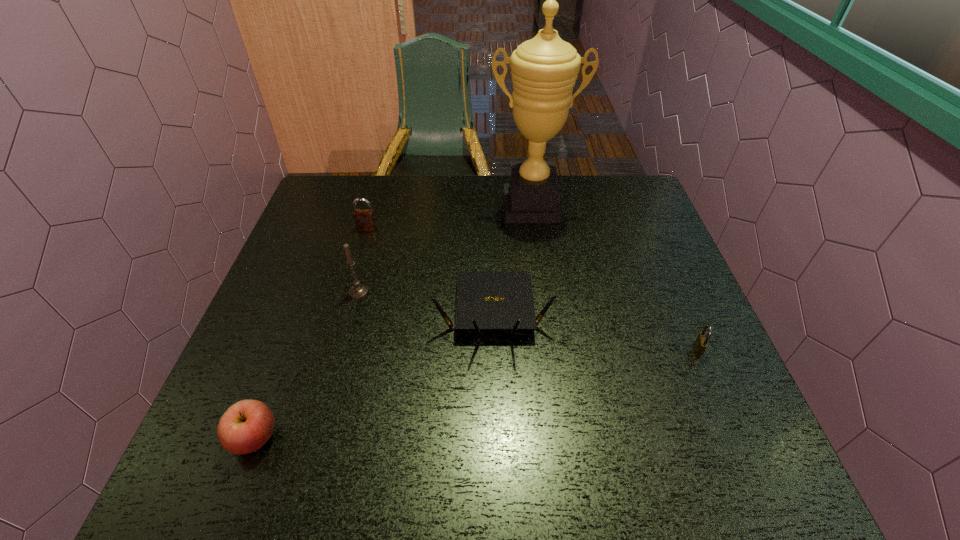
Find the location of a particular element. This screenshot has width=960, height=540. free spot between the fifth shortest object and the tallest object is located at coordinates (444, 249).

Where is `free space between the fifth shortest object and the router`? free space between the fifth shortest object and the router is located at coordinates (425, 302).

Locate an element on the screen. The height and width of the screenshot is (540, 960). vacant region between the fifth shortest object and the router is located at coordinates (425, 302).

The image size is (960, 540). What are the coordinates of `vacant space that is in between the router and the candle` in the screenshot? It's located at (425, 302).

Where is `free space between the candle and the router`? This screenshot has width=960, height=540. free space between the candle and the router is located at coordinates (425, 302).

Where is `object that is the closest to the right padlock`? object that is the closest to the right padlock is located at coordinates (485, 301).

This screenshot has height=540, width=960. What are the coordinates of `the third closest object to the leftmost object` in the screenshot? It's located at (364, 218).

Locate an element on the screen. This screenshot has height=540, width=960. vacant space that satisfies the following two spatial constraints: 1. on the front-facing side of the second farthest object; 2. on the right side of the second tallest object is located at coordinates (349, 292).

Where is `vacant space that satisfies the following two spatial constraints: 1. on the front-facing side of the farther padlock; 2. on the right side of the rightmost object`? This screenshot has height=540, width=960. vacant space that satisfies the following two spatial constraints: 1. on the front-facing side of the farther padlock; 2. on the right side of the rightmost object is located at coordinates click(332, 350).

Locate an element on the screen. The image size is (960, 540). free space that satisfies the following two spatial constraints: 1. on the front-facing side of the farther padlock; 2. on the left side of the second tallest object is located at coordinates (349, 292).